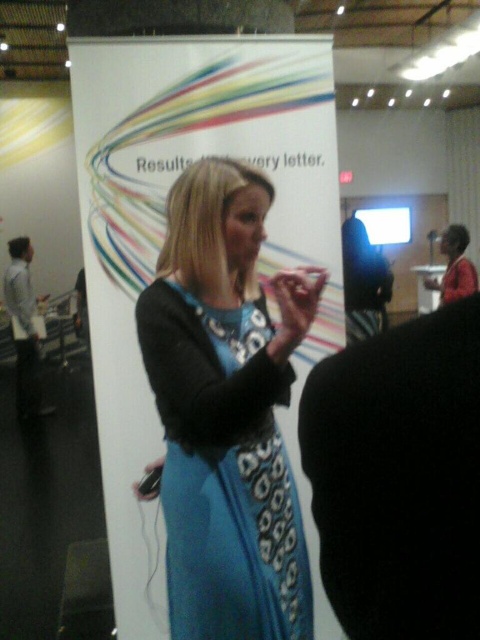
Which is below, white paper at center or blue printed fabric dress at center?

blue printed fabric dress at center

Can you confirm if white paper at center is wider than blue printed fabric dress at center?

Indeed, white paper at center has a greater width compared to blue printed fabric dress at center.

Who is more distant from viewer, (307,486) or (228,580)?

The point (307,486) is more distant.

The height and width of the screenshot is (640, 480). In order to click on white paper at center in this screenshot , I will do pyautogui.click(x=164, y=236).